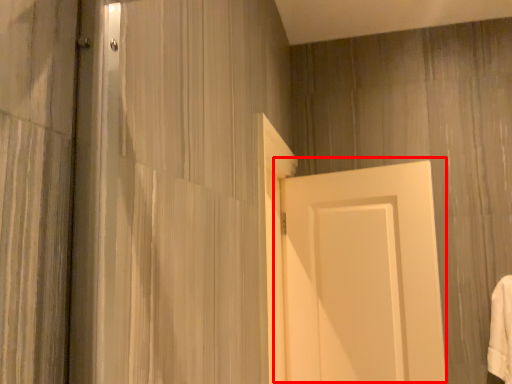
Question: From the image, what is the correct spatial relationship of door (annotated by the red box) in relation to bath towel?

Choices:
 (A) right
 (B) left

Answer: (B)